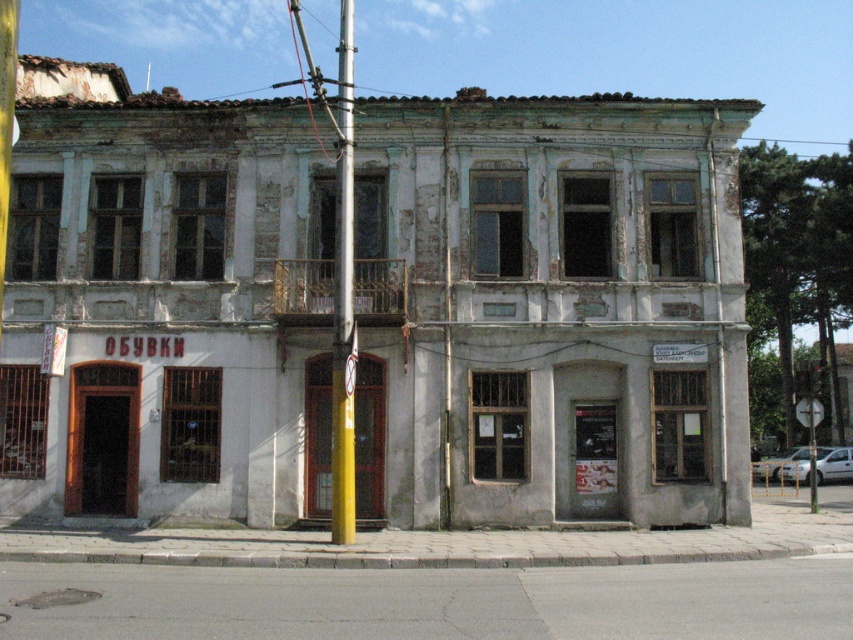
Question: Which of the following is the closest to the observer?

Choices:
 (A) (347, 440)
 (B) (810, 508)

Answer: (A)

Question: Does yellow painted metal pole at center have a larger size compared to white plastic sign at upper right?

Choices:
 (A) yes
 (B) no

Answer: (A)

Question: Which of the following is the farthest from the observer?

Choices:
 (A) yellow painted metal pole at center
 (B) white plastic sign at upper right

Answer: (B)

Question: In this image, where is yellow painted metal pole at center located relative to white plastic sign at upper right?

Choices:
 (A) right
 (B) left

Answer: (B)

Question: Does yellow painted metal pole at center appear over white plastic sign at upper right?

Choices:
 (A) no
 (B) yes

Answer: (B)